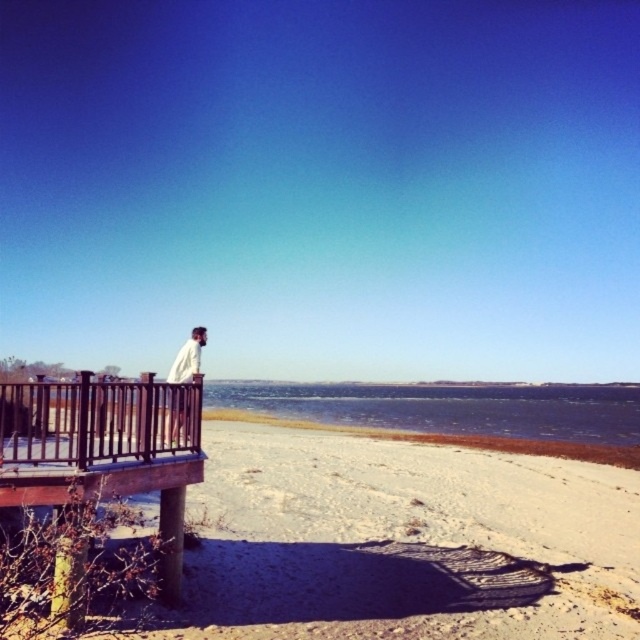
Which is below, brown wooden balustrade at left or white matte jacket at upper left?

white matte jacket at upper left

Between point (28, 492) and point (198, 372), which one is positioned behind?

The point (198, 372) is behind.

I want to click on brown wooden balustrade at left, so click(x=104, y=449).

Is white sandy beach at lower left above brown wooden balustrade at left?

Actually, white sandy beach at lower left is below brown wooden balustrade at left.

Who is higher up, white sandy beach at lower left or brown wooden balustrade at left?

brown wooden balustrade at left is above.

Locate an element on the screen. white sandy beach at lower left is located at coordinates (403, 541).

Identify the location of white sandy beach at lower left. The image size is (640, 640). (403, 541).

The height and width of the screenshot is (640, 640). In order to click on white sandy beach at lower left in this screenshot , I will do `click(403, 541)`.

Is white sandy beach at lower left thinner than white matte jacket at upper left?

Indeed, white sandy beach at lower left has a lesser width compared to white matte jacket at upper left.

The image size is (640, 640). Describe the element at coordinates (403, 541) in the screenshot. I see `white sandy beach at lower left` at that location.

Find the location of `white sandy beach at lower left`. white sandy beach at lower left is located at coordinates point(403,541).